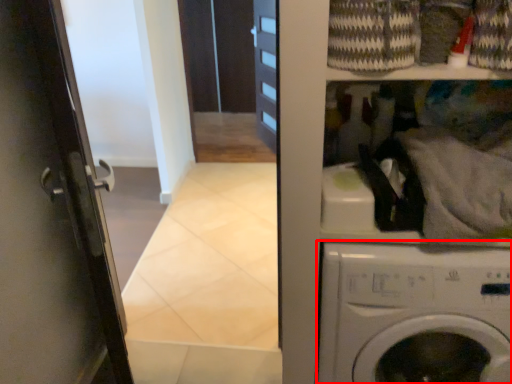
Question: From the image, what is the correct spatial relationship of washing machine (annotated by the red box) in relation to laundry?

Choices:
 (A) left
 (B) right

Answer: (B)